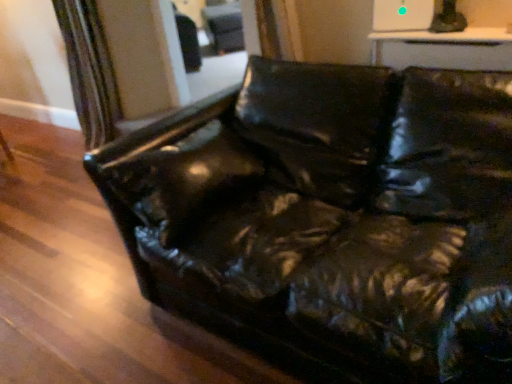
What is the approximate width of shiny black leather couch at center?

shiny black leather couch at center is 1.19 meters in width.

This screenshot has height=384, width=512. What are the coordinates of `shiny black leather couch at center` in the screenshot? It's located at (332, 217).

Consider the image. What is the approximate height of shiny black leather couch at center?

The height of shiny black leather couch at center is 34.13 inches.

What do you see at coordinates (332, 217) in the screenshot? This screenshot has width=512, height=384. I see `shiny black leather couch at center` at bounding box center [332, 217].

The height and width of the screenshot is (384, 512). I want to click on black leather swivel chair at upper center, so click(224, 27).

This screenshot has width=512, height=384. Describe the element at coordinates (224, 27) in the screenshot. I see `black leather swivel chair at upper center` at that location.

What is the approximate width of black leather swivel chair at upper center?

black leather swivel chair at upper center is 33.37 inches wide.

I want to click on shiny black leather couch at center, so click(x=332, y=217).

Is black leather swivel chair at upper center to the right of shiny black leather couch at center from the viewer's perspective?

Incorrect, black leather swivel chair at upper center is not on the right side of shiny black leather couch at center.

Considering the relative positions of black leather swivel chair at upper center and shiny black leather couch at center in the image provided, is black leather swivel chair at upper center in front of shiny black leather couch at center?

No, black leather swivel chair at upper center is further to the viewer.

Is point (211, 26) behind point (141, 241)?

Yes, it is.

From the image's perspective, is black leather swivel chair at upper center located beneath shiny black leather couch at center?

No.

From a real-world perspective, relative to shiny black leather couch at center, is black leather swivel chair at upper center vertically above or below?

In terms of real-world spatial position, black leather swivel chair at upper center is above shiny black leather couch at center.

Can you confirm if black leather swivel chair at upper center is wider than shiny black leather couch at center?

In fact, black leather swivel chair at upper center might be narrower than shiny black leather couch at center.

Between black leather swivel chair at upper center and shiny black leather couch at center, which one has less height?

black leather swivel chair at upper center is shorter.

In terms of size, does black leather swivel chair at upper center appear bigger or smaller than shiny black leather couch at center?

Considering their sizes, black leather swivel chair at upper center takes up less space than shiny black leather couch at center.

Is black leather swivel chair at upper center not within shiny black leather couch at center?

Yes, black leather swivel chair at upper center is outside of shiny black leather couch at center.

Would you consider black leather swivel chair at upper center to be distant from shiny black leather couch at center?

Indeed, black leather swivel chair at upper center is not near shiny black leather couch at center.

Could you tell me if black leather swivel chair at upper center is facing shiny black leather couch at center?

Yes, black leather swivel chair at upper center is facing shiny black leather couch at center.

You are a GUI agent. You are given a task and a screenshot of the screen. Output one action in this format:
    pyautogui.click(x=<x>, y=<y>)
    Task: Click on the studio couch located underneath the black leather swivel chair at upper center (from a real-world perspective)
    Image resolution: width=512 pixels, height=384 pixels.
    Given the screenshot: What is the action you would take?
    pyautogui.click(x=332, y=217)

Is shiny black leather couch at center to the left of black leather swivel chair at upper center from the viewer's perspective?

No, shiny black leather couch at center is not to the left of black leather swivel chair at upper center.

Considering the positions of objects shiny black leather couch at center and black leather swivel chair at upper center in the image provided, who is behind, shiny black leather couch at center or black leather swivel chair at upper center?

black leather swivel chair at upper center is further from the camera.

Which is in front, point (305, 328) or point (220, 29)?

The point (305, 328) is in front.

From the image's perspective, is shiny black leather couch at center under black leather swivel chair at upper center?

Yes, from the image's perspective, shiny black leather couch at center is below black leather swivel chair at upper center.

From a real-world perspective, is shiny black leather couch at center on top of black leather swivel chair at upper center?

No, from a real-world perspective, shiny black leather couch at center is not above black leather swivel chair at upper center.

Looking at their sizes, would you say shiny black leather couch at center is wider or thinner than black leather swivel chair at upper center?

In the image, shiny black leather couch at center appears to be wider than black leather swivel chair at upper center.

Is shiny black leather couch at center taller than black leather swivel chair at upper center?

Correct, shiny black leather couch at center is much taller as black leather swivel chair at upper center.

Is shiny black leather couch at center bigger than black leather swivel chair at upper center?

Yes.

In the scene shown: Is shiny black leather couch at center not within black leather swivel chair at upper center?

That's correct, shiny black leather couch at center is outside of black leather swivel chair at upper center.

Is shiny black leather couch at center next to black leather swivel chair at upper center and touching it?

No.

Looking at this image, could you tell me if shiny black leather couch at center is facing black leather swivel chair at upper center?

No, shiny black leather couch at center is not oriented towards black leather swivel chair at upper center.

How different are the orientations of shiny black leather couch at center and black leather swivel chair at upper center in degrees?

They differ by 50.5 degrees in their facing directions.

How far apart are shiny black leather couch at center and black leather swivel chair at upper center?

shiny black leather couch at center is 4.21 meters away from black leather swivel chair at upper center.

This screenshot has width=512, height=384. What are the coordinates of `studio couch that is on the right side of black leather swivel chair at upper center` in the screenshot? It's located at (332, 217).

Find the location of a particular element. This screenshot has width=512, height=384. swivel chair on the left of shiny black leather couch at center is located at coordinates (224, 27).

Find the location of `studio couch that is in front of the black leather swivel chair at upper center`. studio couch that is in front of the black leather swivel chair at upper center is located at coordinates [x=332, y=217].